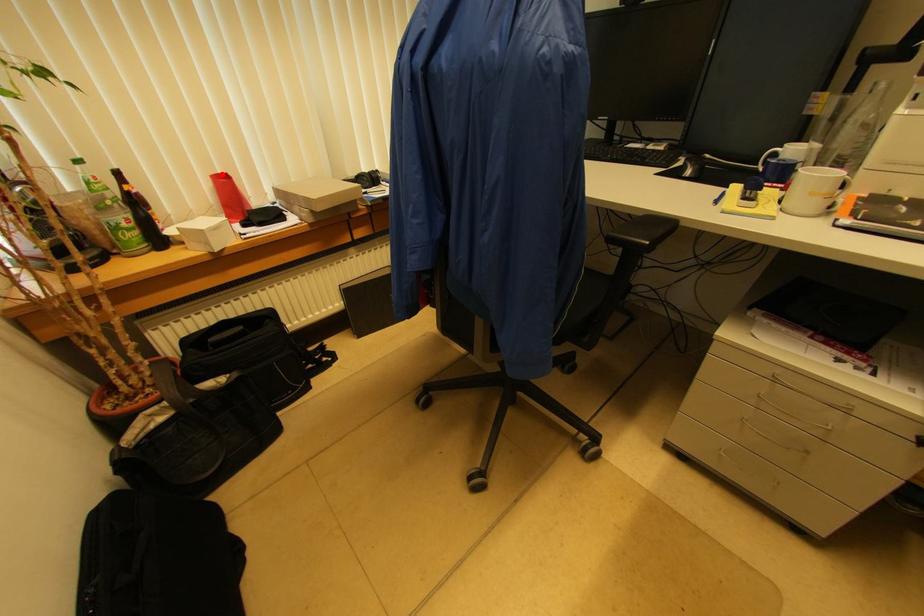
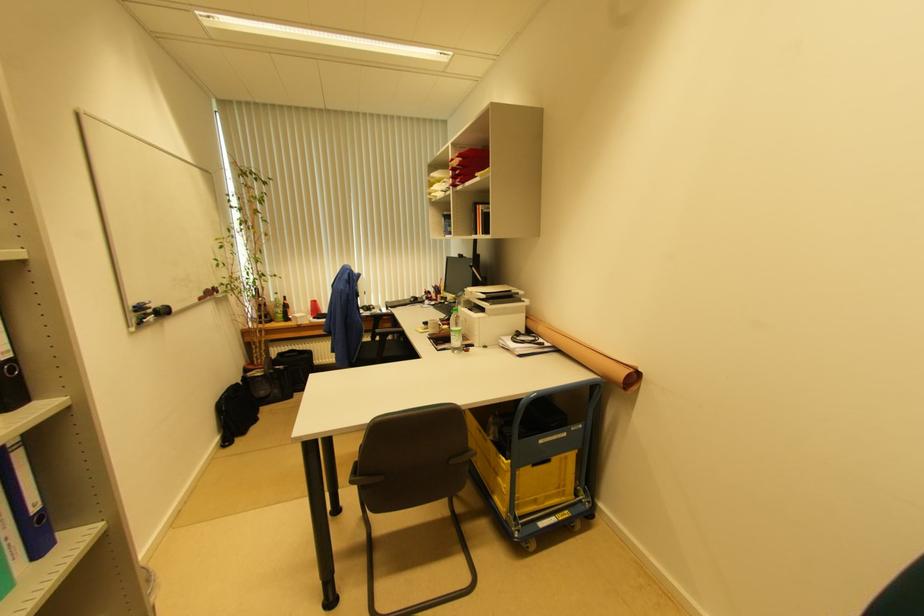
Question: I am providing you with two images of the same scene from different viewpoints. A red point is shown in image1. For the corresponding object point in image2, is it positioned nearer or farther from the camera?

Choices:
 (A) Nearer
 (B) Farther

Answer: (B)